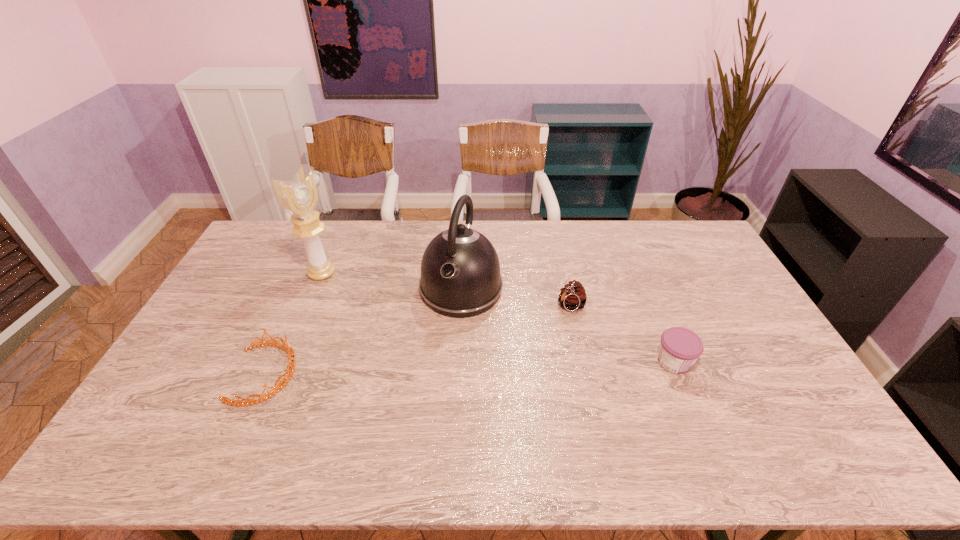
Find the location of a particular element. The image size is (960, 540). free space on the desktop that is between the tiara and the jam and is positioned with a leaf charm attached to the second object from right to left is located at coordinates (493, 367).

This screenshot has height=540, width=960. I want to click on free space on the desktop that is between the tiara and the rightmost object and is positioned on the front-facing side of the award, so click(502, 367).

Locate an element on the screen. This screenshot has width=960, height=540. vacant spot on the desktop that is between the tiara and the rightmost object and is positioned on the spout of the kettle is located at coordinates (431, 369).